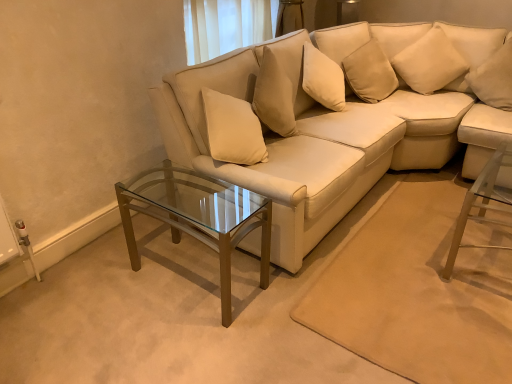
Question: Considering the positions of soft beige pillow at upper right, the 1th pillow when ordered from left to right, and clear glass coffee table at center in the image, is soft beige pillow at upper right, the 1th pillow when ordered from left to right, wider or thinner than clear glass coffee table at center?

Choices:
 (A) thin
 (B) wide

Answer: (A)

Question: Is soft beige pillow at upper right, the 1th pillow when ordered from left to right, bigger or smaller than clear glass coffee table at center?

Choices:
 (A) small
 (B) big

Answer: (A)

Question: Which of these objects is positioned farthest from the clear glass coffee table at center?

Choices:
 (A) soft beige pillow at upper right, the 2th pillow viewed from the right
 (B) white soft pillow at upper right, which is the 2th pillow from left to right
 (C) matte white couch at center

Answer: (B)

Question: Estimate the real-world distances between objects in this image. Which object is closer to the matte white couch at center?

Choices:
 (A) white soft pillow at upper right, which is the 2th pillow from left to right
 (B) clear glass coffee table at center
 (C) soft beige pillow at upper right, the 1th pillow when ordered from left to right

Answer: (C)